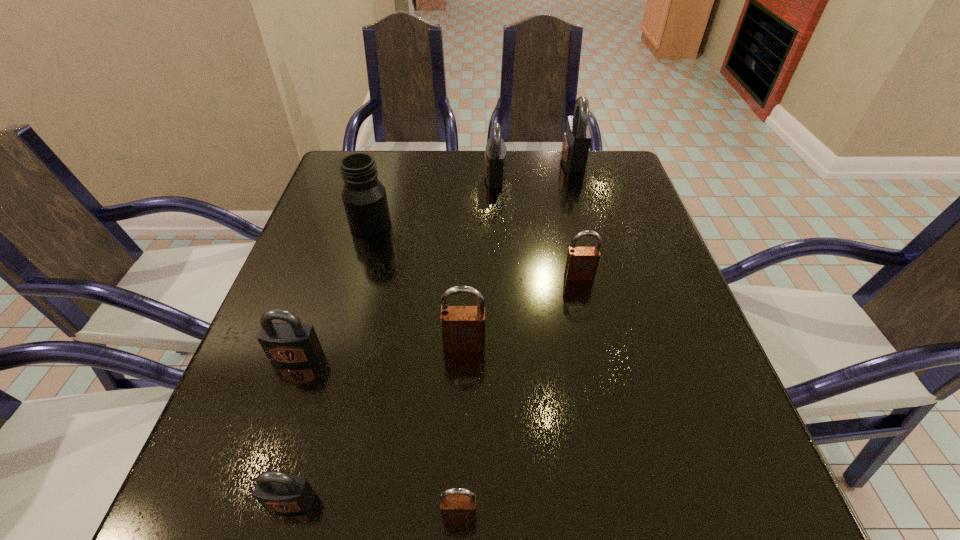
Where is `vacant area located on the front of the third biggest gray padlock near the keyhole`? The width and height of the screenshot is (960, 540). vacant area located on the front of the third biggest gray padlock near the keyhole is located at coordinates (267, 440).

The width and height of the screenshot is (960, 540). Find the location of `jar that is positioned at the left edge`. jar that is positioned at the left edge is located at coordinates (364, 197).

Locate an element on the screen. The height and width of the screenshot is (540, 960). object located at the right edge is located at coordinates (577, 136).

At what (x,y) coordinates should I click in order to perform the action: click on object that is at the near left corner. Please return your answer as a coordinate pair (x, y). The height and width of the screenshot is (540, 960). Looking at the image, I should click on (276, 491).

Locate an element on the screen. This screenshot has height=540, width=960. object that is at the far right corner is located at coordinates (577, 136).

The image size is (960, 540). In the image, there is a desktop. Identify the location of vacant space at the far edge. (415, 149).

Identify the location of vacant space at the near edge of the desktop. (540, 530).

This screenshot has height=540, width=960. Find the location of `vacant space at the left edge of the desktop`. vacant space at the left edge of the desktop is located at coordinates (315, 376).

Find the location of a particular element. The image size is (960, 540). vacant area at the right edge is located at coordinates (628, 201).

The height and width of the screenshot is (540, 960). What are the coordinates of `vacant position at the far left corner of the desktop` in the screenshot? It's located at (325, 183).